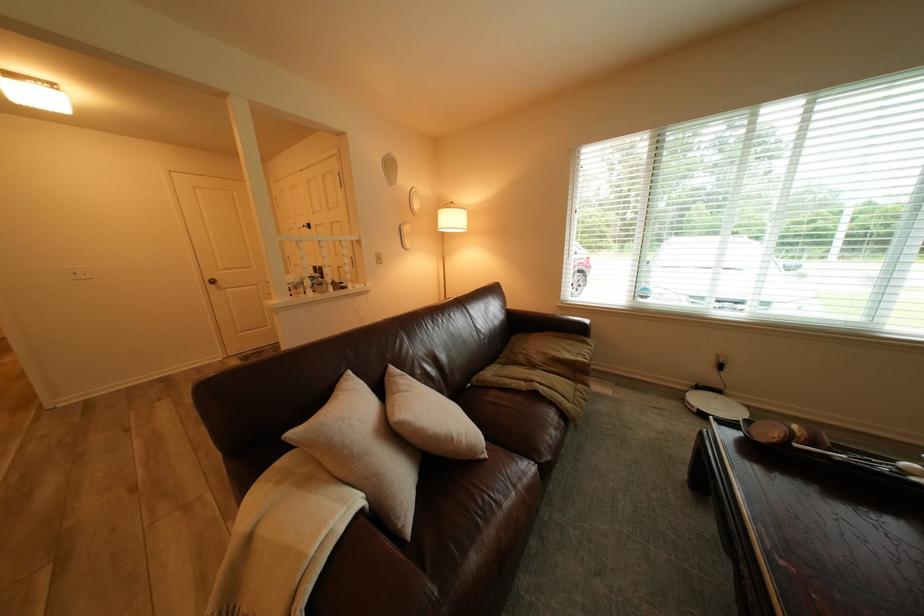
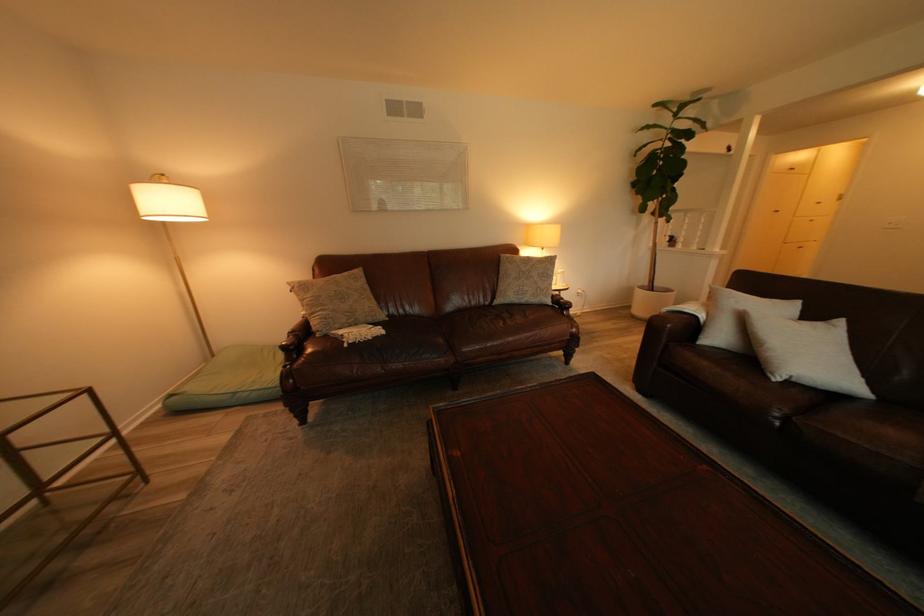
Find the pixel in the second image that matches point 502,458 in the first image.

(787, 381)